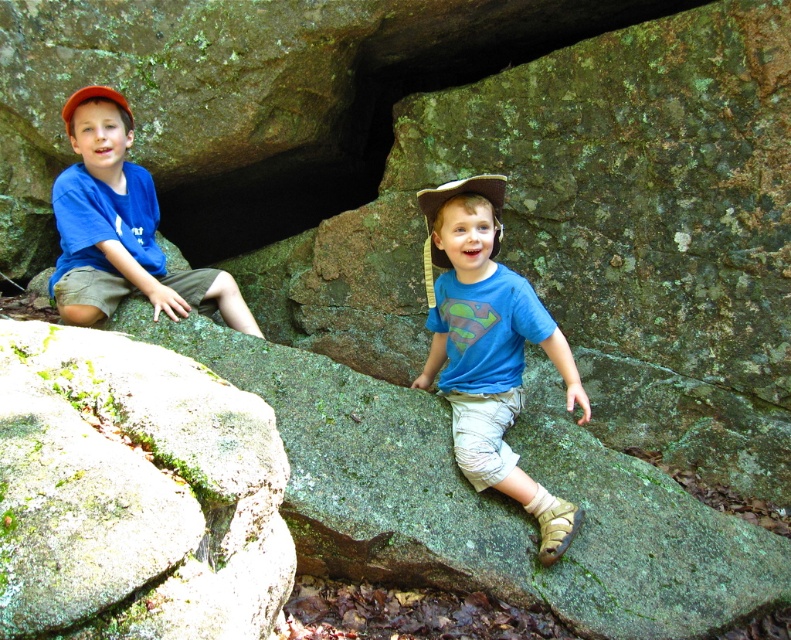
From the picture: You are a photographer trying to capture a clear photo of the matte blue shirt at left and the orange fabric baseball cap at left. Since you want both items to appear equally prominent in the photo, which one should you zoom in on more?

The matte blue shirt at left is larger in size than the orange fabric baseball cap at left, so you should zoom in more on the orange fabric baseball cap at left to make both appear equally prominent.